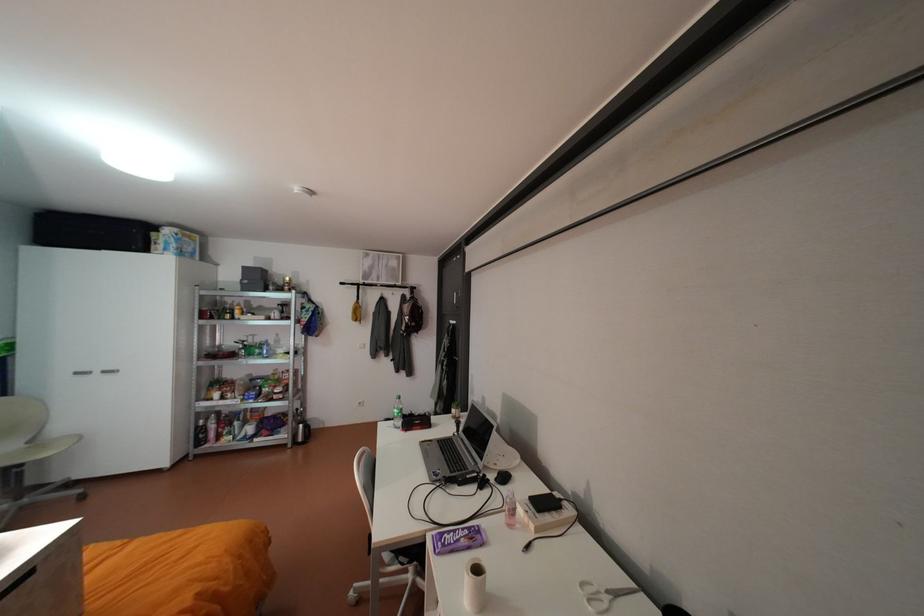
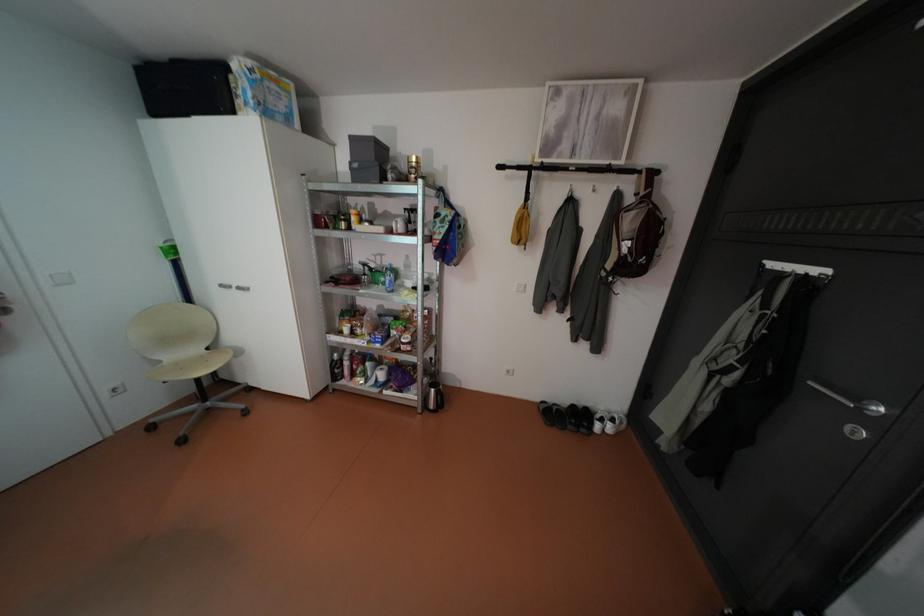
Find the pixel in the second image that matches (86,371) in the first image.

(232, 285)